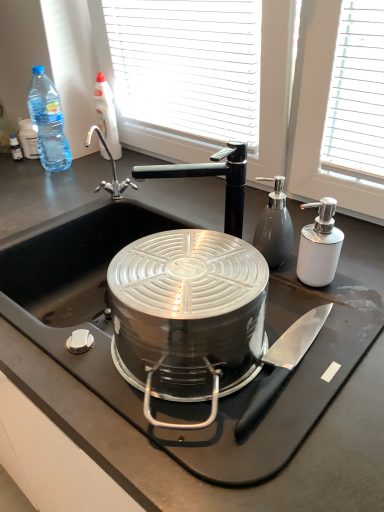
Question: Considering the relative positions of black matte faucet at upper center and black matte countertop at center in the image provided, is black matte faucet at upper center to the right of black matte countertop at center from the viewer's perspective?

Choices:
 (A) no
 (B) yes

Answer: (B)

Question: Is black matte faucet at upper center not inside black matte countertop at center?

Choices:
 (A) no
 (B) yes

Answer: (B)

Question: Considering the relative positions of black matte faucet at upper center and black matte countertop at center in the image provided, is black matte faucet at upper center in front of black matte countertop at center?

Choices:
 (A) no
 (B) yes

Answer: (A)

Question: Is black matte faucet at upper center shorter than black matte countertop at center?

Choices:
 (A) yes
 (B) no

Answer: (A)

Question: Is black matte faucet at upper center facing away from black matte countertop at center?

Choices:
 (A) yes
 (B) no

Answer: (B)

Question: Considering the relative positions of clear plastic bottle at upper left, which ranks as the second bottle in right-to-left order, and white glossy soap dispenser at right in the image provided, is clear plastic bottle at upper left, which ranks as the second bottle in right-to-left order, to the left or to the right of white glossy soap dispenser at right?

Choices:
 (A) right
 (B) left

Answer: (B)

Question: Based on their sizes in the image, would you say clear plastic bottle at upper left, which appears as the 2th bottle when viewed from the left, is bigger or smaller than white glossy soap dispenser at right?

Choices:
 (A) big
 (B) small

Answer: (A)

Question: Relative to white glossy soap dispenser at right, is clear plastic bottle at upper left, which ranks as the 1th bottle in back-to-front order, in front or behind?

Choices:
 (A) front
 (B) behind

Answer: (B)

Question: From a real-world perspective, is clear plastic bottle at upper left, which ranks as the second bottle in right-to-left order, above or below white glossy soap dispenser at right?

Choices:
 (A) below
 (B) above

Answer: (B)

Question: From a real-world perspective, is black matte faucet at upper center positioned above or below white glossy soap dispenser at right?

Choices:
 (A) below
 (B) above

Answer: (B)

Question: Considering the positions of point (241, 188) and point (337, 247), is point (241, 188) closer or farther from the camera than point (337, 247)?

Choices:
 (A) farther
 (B) closer

Answer: (A)

Question: Based on their sizes in the image, would you say black matte faucet at upper center is bigger or smaller than white glossy soap dispenser at right?

Choices:
 (A) small
 (B) big

Answer: (B)

Question: From the image's perspective, is black matte faucet at upper center located above or below white glossy soap dispenser at right?

Choices:
 (A) below
 (B) above

Answer: (B)

Question: Relative to white glossy soap dispenser at right, is satin silver pump dispenser at right, positioned as the 1th bottle in right-to-left order, in front or behind?

Choices:
 (A) front
 (B) behind

Answer: (B)

Question: Is satin silver pump dispenser at right, the 3th bottle when ordered from back to front, wider or thinner than white glossy soap dispenser at right?

Choices:
 (A) thin
 (B) wide

Answer: (A)